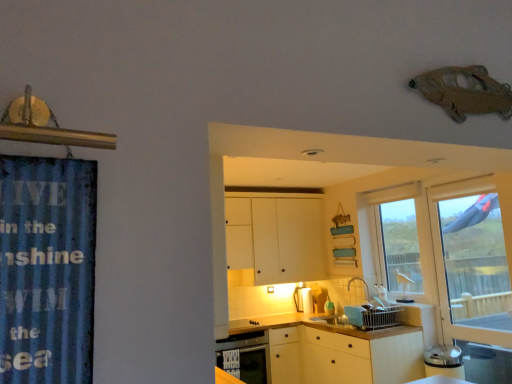
Question: Is matte white dishwasher at lower center positioned with its back to blue corrugated metal at left?

Choices:
 (A) yes
 (B) no

Answer: (B)

Question: Could you tell me if matte white dishwasher at lower center is turned towards blue corrugated metal at left?

Choices:
 (A) yes
 (B) no

Answer: (B)

Question: Is matte white dishwasher at lower center positioned in front of blue corrugated metal at left?

Choices:
 (A) no
 (B) yes

Answer: (A)

Question: Considering the relative sizes of matte white dishwasher at lower center and blue corrugated metal at left in the image provided, is matte white dishwasher at lower center thinner than blue corrugated metal at left?

Choices:
 (A) yes
 (B) no

Answer: (B)

Question: Would you say blue corrugated metal at left is part of matte white dishwasher at lower center's contents?

Choices:
 (A) no
 (B) yes

Answer: (A)

Question: Considering the positions of white matte counter top at lower center and matte white toaster at lower center, which is the 2th appliance from front to back, in the image, is white matte counter top at lower center wider or thinner than matte white toaster at lower center, which is the 2th appliance from front to back,?

Choices:
 (A) thin
 (B) wide

Answer: (B)

Question: Considering their positions, is white matte counter top at lower center located in front of or behind matte white toaster at lower center, which is the 2th appliance from front to back?

Choices:
 (A) front
 (B) behind

Answer: (A)

Question: From the image's perspective, is white matte counter top at lower center above or below matte white toaster at lower center, which is the second appliance from back to front?

Choices:
 (A) below
 (B) above

Answer: (A)

Question: Does point (288, 327) appear closer or farther from the camera than point (316, 289)?

Choices:
 (A) farther
 (B) closer

Answer: (B)

Question: From a real-world perspective, is white glossy paper towel dispenser at center, the 1th appliance from the left, above or below clear glass window at center?

Choices:
 (A) above
 (B) below

Answer: (B)

Question: In terms of width, does white glossy paper towel dispenser at center, placed as the third appliance when sorted from front to back, look wider or thinner when compared to clear glass window at center?

Choices:
 (A) wide
 (B) thin

Answer: (B)

Question: Which is correct: white glossy paper towel dispenser at center, placed as the third appliance when sorted from front to back, is inside clear glass window at center, or outside of it?

Choices:
 (A) inside
 (B) outside

Answer: (B)

Question: Does point (310, 291) appear closer or farther from the camera than point (385, 269)?

Choices:
 (A) closer
 (B) farther

Answer: (B)

Question: Visually, is blue corrugated metal at left positioned to the left or to the right of white matte cabinet at center?

Choices:
 (A) left
 (B) right

Answer: (A)

Question: Considering the positions of point (65, 349) and point (244, 210), is point (65, 349) closer or farther from the camera than point (244, 210)?

Choices:
 (A) closer
 (B) farther

Answer: (A)